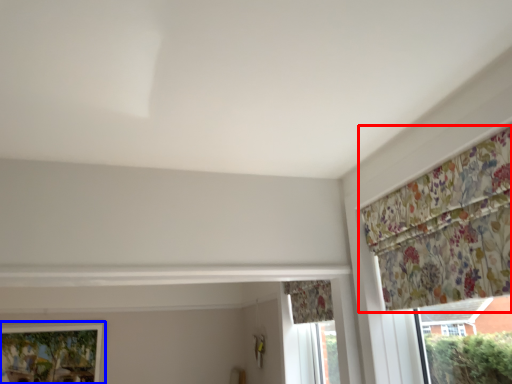
Question: Which object is further to the camera taking this photo, curtain (highlighted by a red box) or window (highlighted by a blue box)?

Choices:
 (A) curtain
 (B) window

Answer: (B)